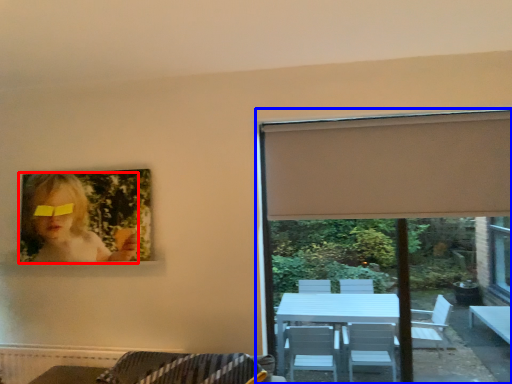
Question: Which object is further to the camera taking this photo, woman (highlighted by a red box) or window (highlighted by a blue box)?

Choices:
 (A) woman
 (B) window

Answer: (A)